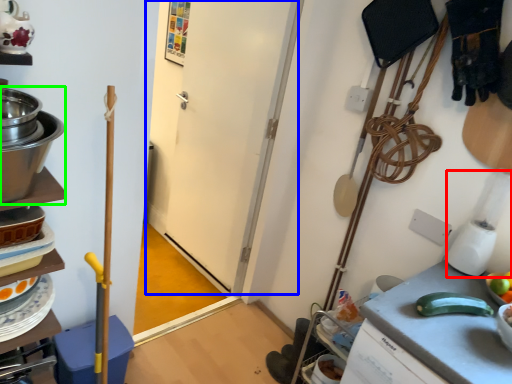
Question: Estimate the real-world distances between objects in this image. Which object is farther from blender (highlighted by a red box), door (highlighted by a blue box) or appliance (highlighted by a green box)?

Choices:
 (A) door
 (B) appliance

Answer: (B)